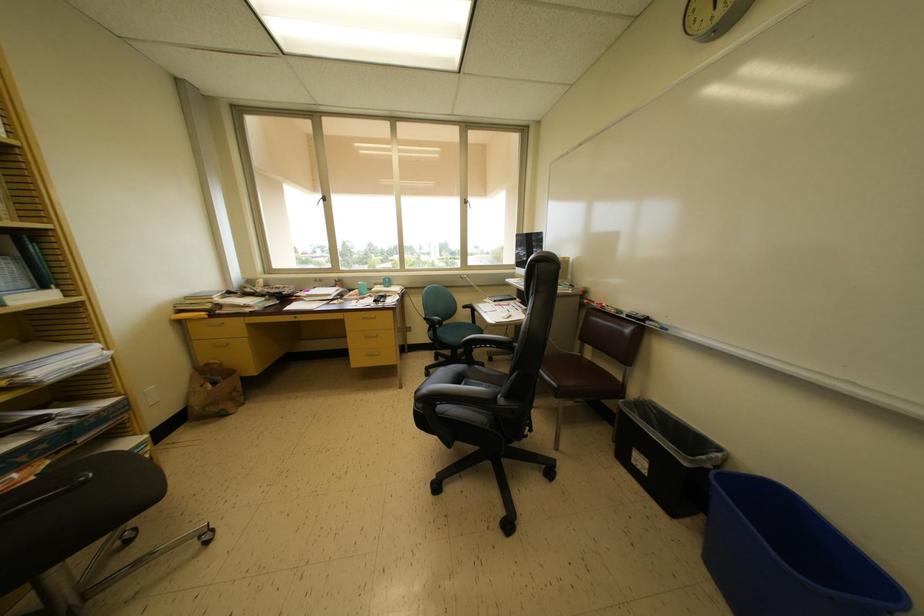
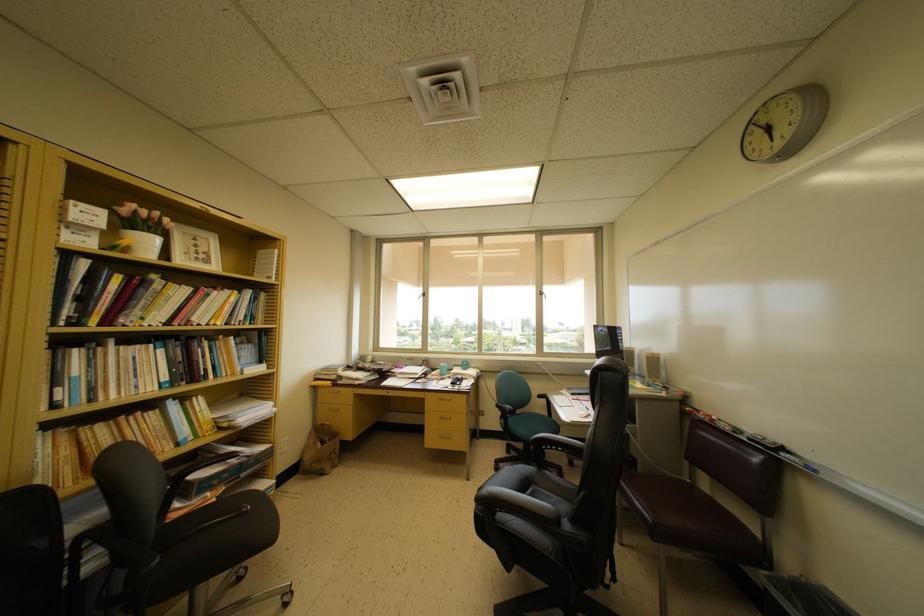
Where in the second image is the point corresponding to point 386,286 from the first image?

(465, 369)